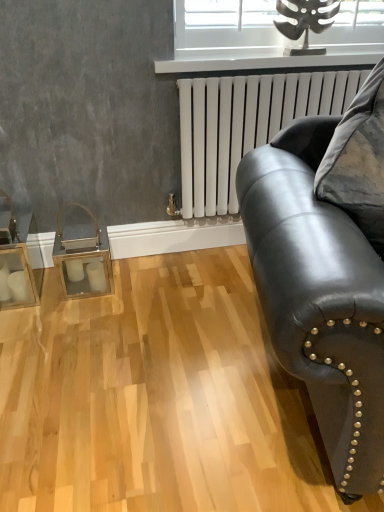
Question: Is metallic silver window at upper center at the back of white glossy radiator at upper center?

Choices:
 (A) no
 (B) yes

Answer: (A)

Question: Is white glossy radiator at upper center taller than metallic silver window at upper center?

Choices:
 (A) no
 (B) yes

Answer: (A)

Question: Does white glossy radiator at upper center have a greater width compared to metallic silver window at upper center?

Choices:
 (A) yes
 (B) no

Answer: (A)

Question: Does white glossy radiator at upper center touch metallic silver window at upper center?

Choices:
 (A) yes
 (B) no

Answer: (B)

Question: Considering the relative positions of white glossy radiator at upper center and metallic silver window at upper center in the image provided, is white glossy radiator at upper center to the left of metallic silver window at upper center from the viewer's perspective?

Choices:
 (A) no
 (B) yes

Answer: (B)

Question: From a real-world perspective, is metallic silver window at upper center above or below black leather couch at right?

Choices:
 (A) below
 (B) above

Answer: (B)

Question: Is point (377, 38) positioned closer to the camera than point (362, 377)?

Choices:
 (A) closer
 (B) farther

Answer: (B)

Question: In terms of height, does metallic silver window at upper center look taller or shorter compared to black leather couch at right?

Choices:
 (A) tall
 (B) short

Answer: (B)

Question: Relative to black leather couch at right, is metallic silver window at upper center in front or behind?

Choices:
 (A) behind
 (B) front

Answer: (A)

Question: Looking at their shapes, would you say black leather couch at right is wider or thinner than metallic silver window at upper center?

Choices:
 (A) wide
 (B) thin

Answer: (A)

Question: Relative to metallic silver window at upper center, is black leather couch at right in front or behind?

Choices:
 (A) front
 (B) behind

Answer: (A)

Question: From a real-world perspective, relative to metallic silver window at upper center, is black leather couch at right vertically above or below?

Choices:
 (A) above
 (B) below

Answer: (B)

Question: Considering the positions of point (266, 314) and point (314, 42), is point (266, 314) closer or farther from the camera than point (314, 42)?

Choices:
 (A) farther
 (B) closer

Answer: (B)

Question: Looking at the image, does metallic silver window at upper center seem bigger or smaller compared to white matte radiator at upper right?

Choices:
 (A) small
 (B) big

Answer: (A)

Question: In the image, is metallic silver window at upper center positioned in front of or behind white matte radiator at upper right?

Choices:
 (A) front
 (B) behind

Answer: (B)